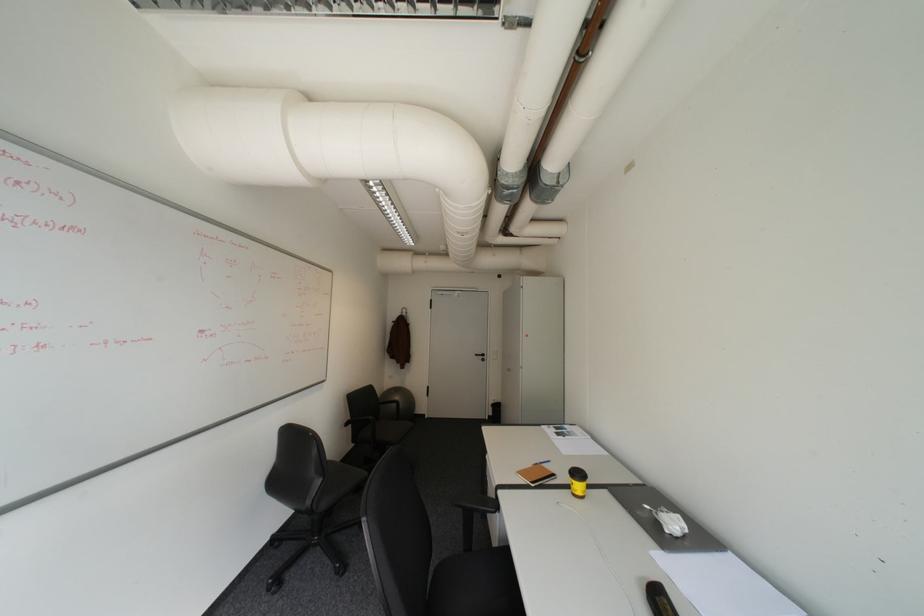
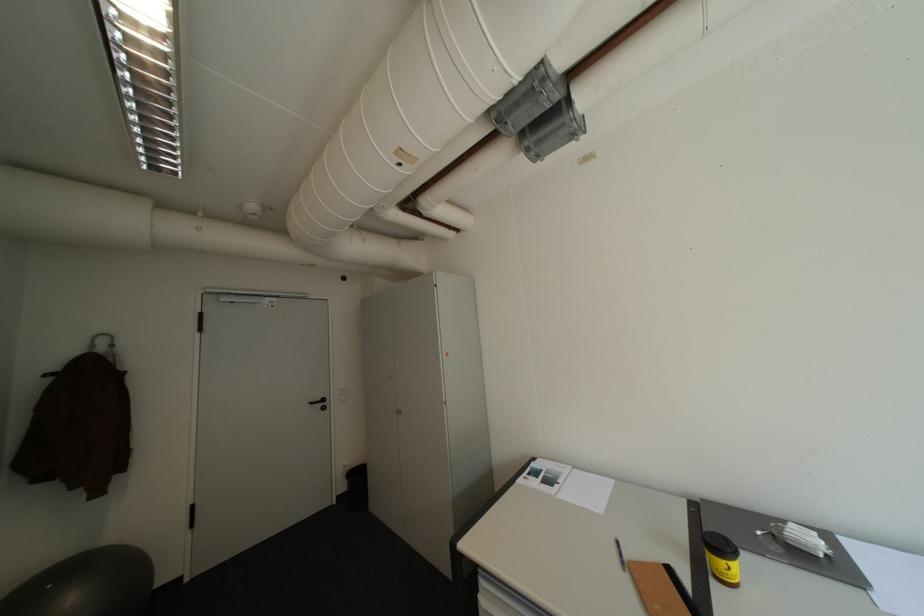
Locate, in the second image, the point that corresponds to (499,415) in the first image.

(347, 493)